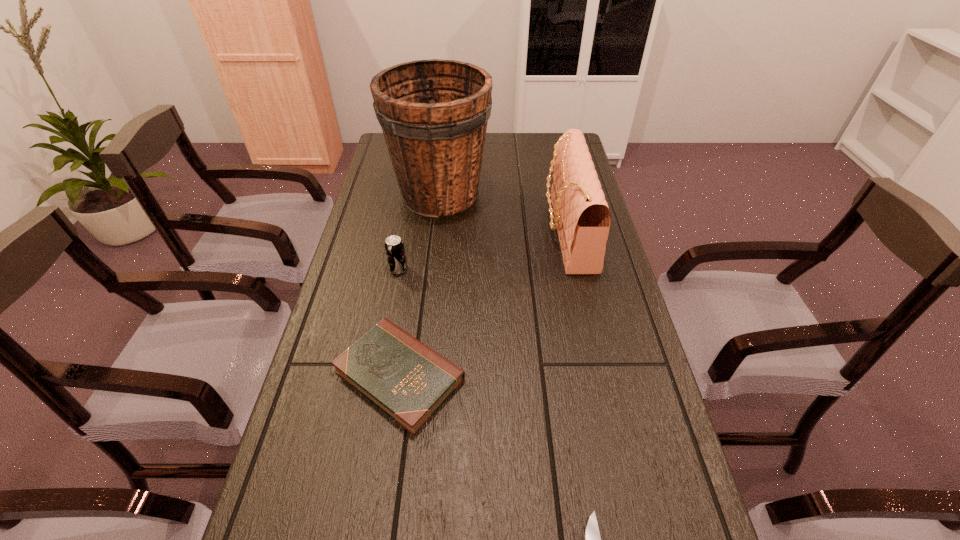
Image resolution: width=960 pixels, height=540 pixels. What are the coordinates of `bucket` in the screenshot? It's located at (433, 113).

You are a GUI agent. You are given a task and a screenshot of the screen. Output one action in this format:
    pyautogui.click(x=<x>, y=<y>)
    Task: Click on the second tallest object
    
    Given the screenshot: What is the action you would take?
    pyautogui.click(x=582, y=218)

Find the location of a particular element. The width and height of the screenshot is (960, 540). the third tallest object is located at coordinates (394, 246).

You are a GUI agent. You are given a task and a screenshot of the screen. Output one action in this format:
    pyautogui.click(x=<x>, y=<y>)
    Task: Click on the Bible
    The image size is (960, 540).
    Given the screenshot: What is the action you would take?
    pyautogui.click(x=406, y=379)

The width and height of the screenshot is (960, 540). In order to click on the second nearest object in this screenshot , I will do `click(406, 379)`.

The height and width of the screenshot is (540, 960). Identify the location of vacant region located on the front of the tallest object. coord(427,314).

At what (x,y) coordinates should I click in order to perform the action: click on free point located 0.090m on the front-facing side of the second tallest object. Please return your answer as a coordinate pair (x, y). The width and height of the screenshot is (960, 540). Looking at the image, I should click on (516, 231).

This screenshot has width=960, height=540. I want to click on vacant region located on the front-facing side of the second tallest object, so click(432, 231).

The width and height of the screenshot is (960, 540). I want to click on free location located on the front-facing side of the second tallest object, so (x=487, y=231).

Identify the location of free space located on the right of the third shortest object. (535, 269).